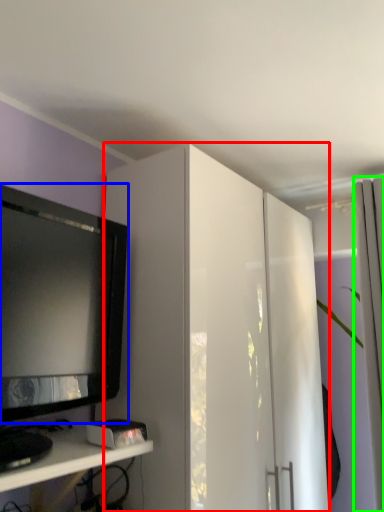
Question: Which object is the closest to the cabinetry (highlighted by a red box)? Choose among these: television (highlighted by a blue box) or curtain (highlighted by a green box).

Choices:
 (A) television
 (B) curtain

Answer: (A)